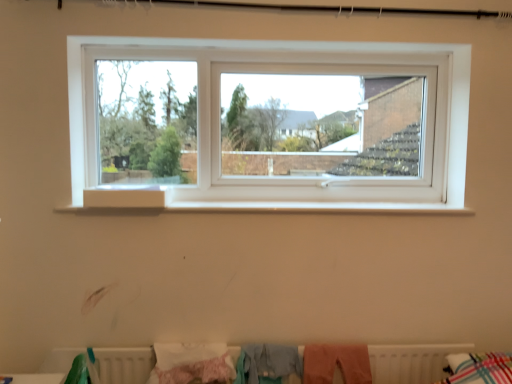
Question: Considering the positions of white matte radiator at lower center and pink fabric at lower center, which is the 3th clothing from left to right, in the image, is white matte radiator at lower center wider or thinner than pink fabric at lower center, which is the 3th clothing from left to right,?

Choices:
 (A) wide
 (B) thin

Answer: (B)

Question: Considering the positions of point (142, 380) and point (361, 380), is point (142, 380) closer or farther from the camera than point (361, 380)?

Choices:
 (A) closer
 (B) farther

Answer: (A)

Question: Which is farther from the pink fabric at lower center, which is the 3th clothing from left to right?

Choices:
 (A) light blue fabric at lower center, placed as the 2th clothing when sorted from left to right
 (B) white matte radiator at lower center
 (C) pink fluffy blanket at lower center, placed as the third clothing when sorted from right to left

Answer: (B)

Question: Based on their relative distances, which object is nearer to the light blue fabric at lower center, placed as the 2th clothing when sorted from left to right?

Choices:
 (A) pink fabric at lower center, which is the 3th clothing from left to right
 (B) white matte radiator at lower center
 (C) pink fluffy blanket at lower center, the first clothing in the left-to-right sequence

Answer: (A)